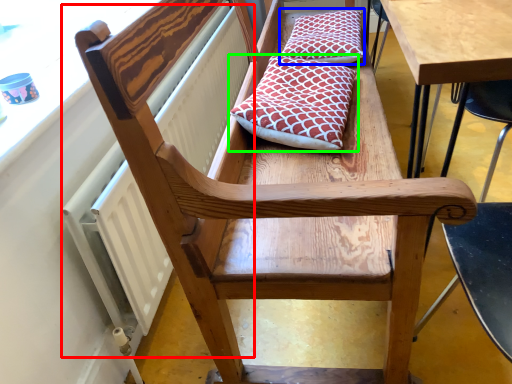
Question: Which object is the closest to the radiator (highlighted by a red box)? Choose among these: pillow (highlighted by a blue box) or pillow (highlighted by a green box).

Choices:
 (A) pillow
 (B) pillow

Answer: (B)